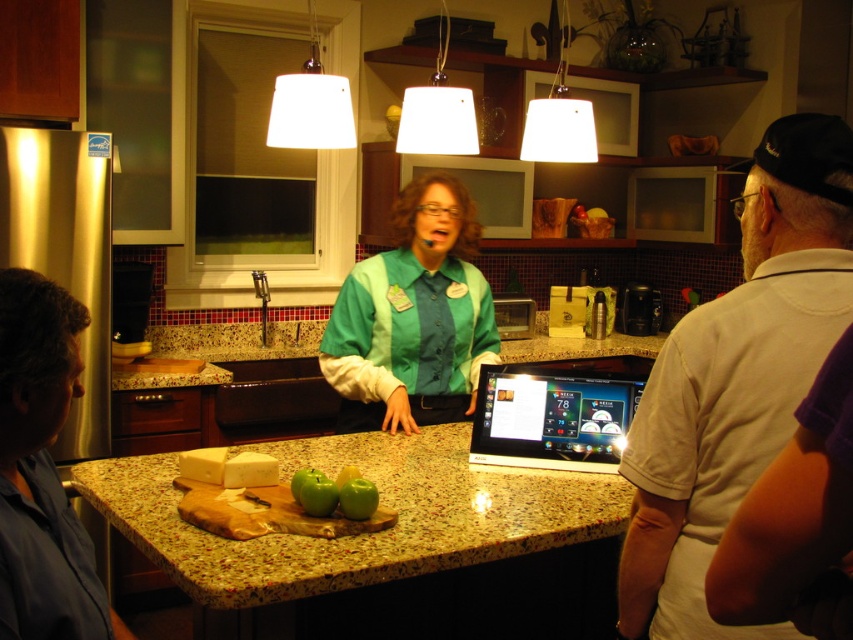
Which is more to the right, speckled granite counter at center or green matte apples at center?

From the viewer's perspective, speckled granite counter at center appears more on the right side.

Between speckled granite counter at center and green matte apples at center, which one is positioned lower?

Positioned lower is speckled granite counter at center.

Between point (335, 577) and point (347, 476), which one is positioned in front?

Point (335, 577) is more forward.

Locate an element on the screen. speckled granite counter at center is located at coordinates (363, 532).

Who is more forward, (x=442, y=262) or (x=589, y=371)?

Point (x=589, y=371) is in front.

You are a GUI agent. You are given a task and a screenshot of the screen. Output one action in this format:
    pyautogui.click(x=<x>, y=<y>)
    Task: Click on the green fabric shirt at center
    This screenshot has width=853, height=640.
    Given the screenshot: What is the action you would take?
    pyautogui.click(x=413, y=317)

Identify the location of green fabric shirt at center. (413, 317).

Does black glossy tablet at center have a smaller size compared to green matte apples at center?

No, black glossy tablet at center is not smaller than green matte apples at center.

The width and height of the screenshot is (853, 640). What do you see at coordinates (555, 413) in the screenshot?
I see `black glossy tablet at center` at bounding box center [555, 413].

At what (x,y) coordinates should I click in order to perform the action: click on black glossy tablet at center. Please return your answer as a coordinate pair (x, y). Image resolution: width=853 pixels, height=640 pixels. Looking at the image, I should click on (555, 413).